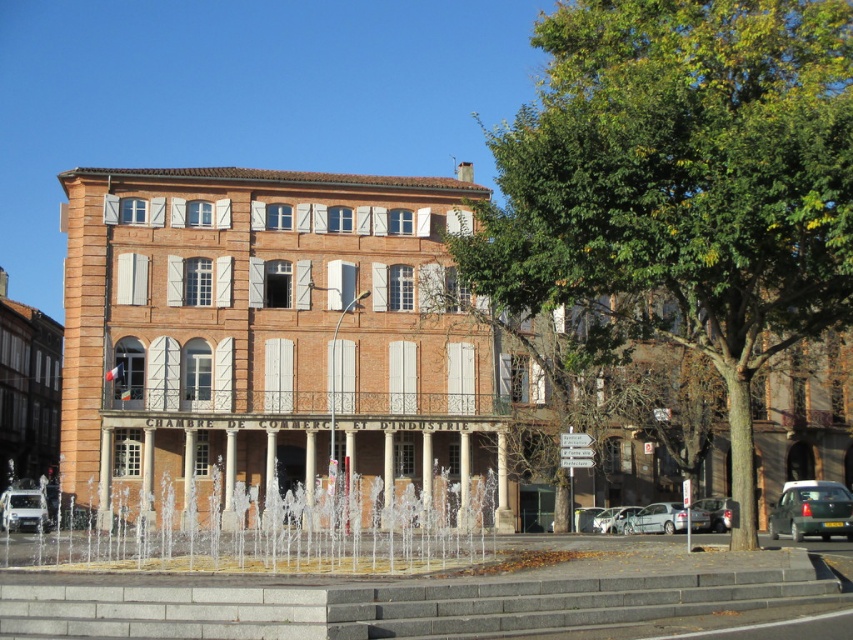
Is clear water at center above silver metallic car at lower right?

Correct, clear water at center is located above silver metallic car at lower right.

Measure the distance from clear water at center to silver metallic car at lower right.

They are 24.28 meters apart.

From the picture: Who is more distant from viewer, (445, 556) or (672, 513)?

Point (672, 513)

The width and height of the screenshot is (853, 640). Find the location of `clear water at center`. clear water at center is located at coordinates (271, 536).

Measure the distance between point (718, 577) and camera.

The distance of point (718, 577) from camera is 113.86 feet.

Is gray concrete stairs at center to the right of shiny silver car at lower right from the viewer's perspective?

In fact, gray concrete stairs at center is to the left of shiny silver car at lower right.

In the scene shown: Who is more forward, (175,627) or (727,508)?

Positioned in front is point (175,627).

Locate an element on the screen. This screenshot has width=853, height=640. gray concrete stairs at center is located at coordinates (413, 600).

Who is positioned more to the left, brown brick building at center or clear water at center?

clear water at center is more to the left.

Locate an element on the screen. This screenshot has height=640, width=853. brown brick building at center is located at coordinates (271, 332).

Does point (404, 316) come closer to viewer compared to point (234, 500)?

No, it is behind (234, 500).

Locate an element on the screen. brown brick building at center is located at coordinates (271, 332).